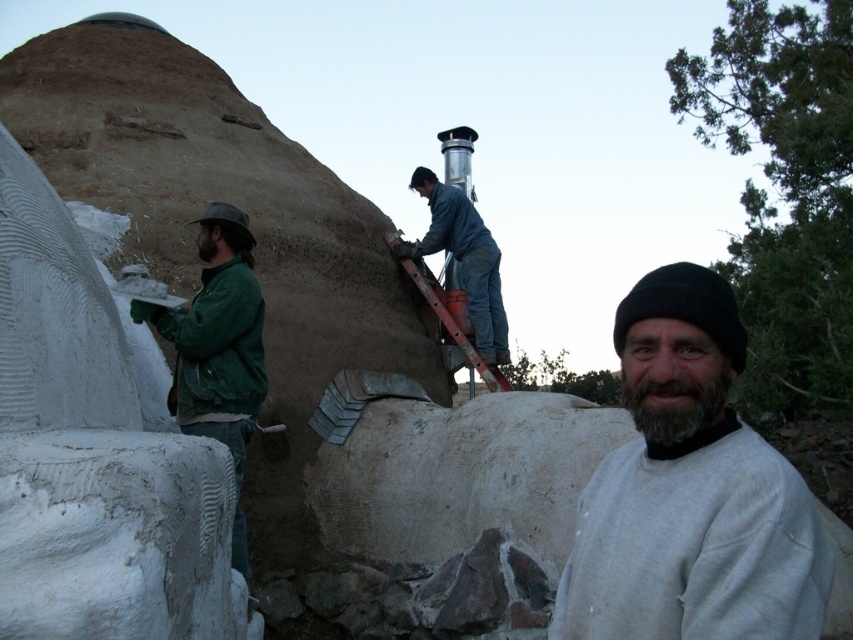
Question: Does green matte jacket at left have a greater width compared to blue denim overalls at center?

Choices:
 (A) no
 (B) yes

Answer: (A)

Question: Can you confirm if green matte jacket at left is positioned to the right of blue denim overalls at center?

Choices:
 (A) yes
 (B) no

Answer: (B)

Question: Which of the following is the farthest from the observer?

Choices:
 (A) blue denim overalls at center
 (B) green matte jacket at left

Answer: (A)

Question: Considering the real-world distances, which object is closest to the blue denim overalls at center?

Choices:
 (A) green matte jacket at left
 (B) gray cotton sweatshirt at center

Answer: (A)

Question: Based on their relative distances, which object is nearer to the gray cotton sweatshirt at center?

Choices:
 (A) blue denim overalls at center
 (B) green matte jacket at left

Answer: (B)

Question: Is gray cotton sweatshirt at center to the left of blue denim overalls at center from the viewer's perspective?

Choices:
 (A) yes
 (B) no

Answer: (B)